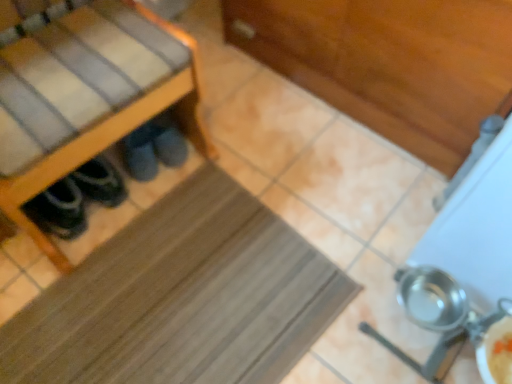
At what (x,y) coordinates should I click in order to perform the action: click on vacant region to the left of metallic silver pot at lower right. Please return your answer as a coordinate pair (x, y). This screenshot has width=512, height=384. Looking at the image, I should click on (324, 321).